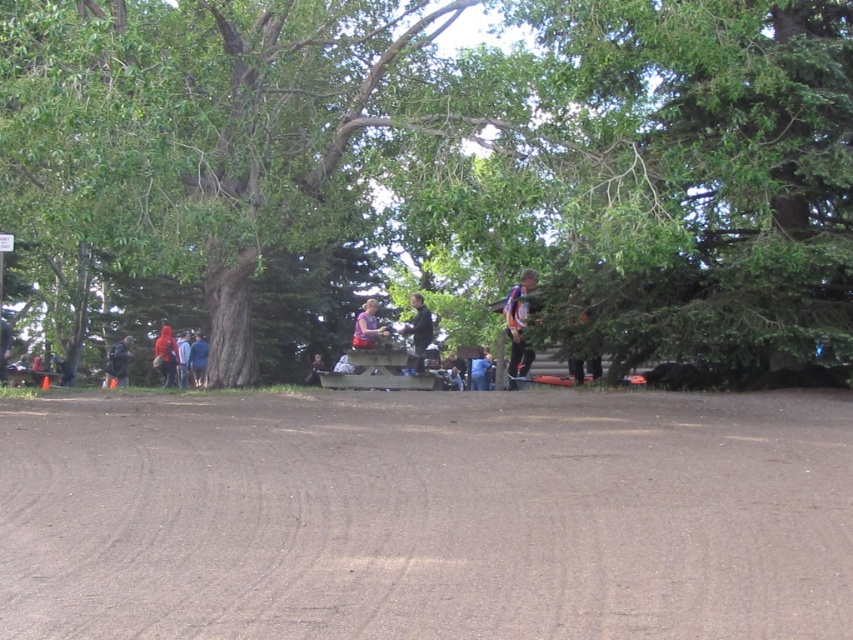
Question: Which point is closer to the camera?

Choices:
 (A) brown dirt track at center
 (B) white cotton shirt at center
 (C) red fabric jacket at lower left
 (D) dark blue shirt at center

Answer: (A)

Question: Which point is closer to the camera?

Choices:
 (A) (416, 330)
 (B) (196, 368)
 (C) (184, 336)

Answer: (A)

Question: Is brown dirt track at center below red fabric jacket at lower left?

Choices:
 (A) no
 (B) yes

Answer: (B)

Question: Does green leafy tree at center have a lesser width compared to blue and white jersey at center?

Choices:
 (A) yes
 (B) no

Answer: (B)

Question: Which point is closer to the camera taking this photo?

Choices:
 (A) (196, 355)
 (B) (416, 333)
 (C) (171, 380)
 (D) (312, 376)

Answer: (B)

Question: Is green leafy tree at center smaller than blue fabric backpack at center?

Choices:
 (A) no
 (B) yes

Answer: (A)